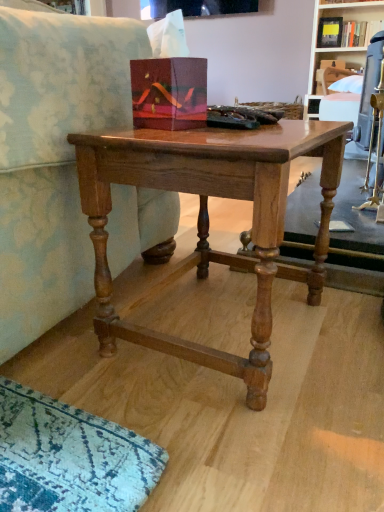
Question: From a real-world perspective, is wooden bookshelf at upper right, which is the first shelf from top to bottom, over shiny brown wood table at center?

Choices:
 (A) no
 (B) yes

Answer: (B)

Question: Is wooden bookshelf at upper right, which is the first shelf from top to bottom, turned away from shiny brown wood table at center?

Choices:
 (A) no
 (B) yes

Answer: (A)

Question: Considering the relative positions of wooden bookshelf at upper right, placed as the second shelf when sorted from bottom to top, and shiny brown wood table at center in the image provided, is wooden bookshelf at upper right, placed as the second shelf when sorted from bottom to top, to the right of shiny brown wood table at center from the viewer's perspective?

Choices:
 (A) yes
 (B) no

Answer: (A)

Question: Can you confirm if wooden bookshelf at upper right, which is the first shelf from top to bottom, is taller than shiny brown wood table at center?

Choices:
 (A) no
 (B) yes

Answer: (B)

Question: Considering the relative sizes of wooden bookshelf at upper right, placed as the second shelf when sorted from bottom to top, and shiny brown wood table at center in the image provided, is wooden bookshelf at upper right, placed as the second shelf when sorted from bottom to top, wider than shiny brown wood table at center?

Choices:
 (A) no
 (B) yes

Answer: (B)

Question: In the image, is shiny brown wood table at center on the left side or the right side of wooden bookshelf at upper right, which is the first shelf from top to bottom?

Choices:
 (A) left
 (B) right

Answer: (A)

Question: Considering the positions of shiny brown wood table at center and wooden bookshelf at upper right, placed as the second shelf when sorted from bottom to top, in the image, is shiny brown wood table at center taller or shorter than wooden bookshelf at upper right, placed as the second shelf when sorted from bottom to top,?

Choices:
 (A) short
 (B) tall

Answer: (A)

Question: Is point (342, 150) closer or farther from the camera than point (339, 48)?

Choices:
 (A) farther
 (B) closer

Answer: (B)

Question: Looking at the image, does shiny brown wood table at center seem bigger or smaller compared to wooden bookshelf at upper right, which is the first shelf from top to bottom?

Choices:
 (A) big
 (B) small

Answer: (B)

Question: Is shiny brown wood table at center inside the boundaries of wooden shelf at upper right, marked as the 1th shelf in a bottom-to-top arrangement, or outside?

Choices:
 (A) outside
 (B) inside

Answer: (A)

Question: From a real-world perspective, is shiny brown wood table at center above or below wooden shelf at upper right, positioned as the 2th shelf in top-to-bottom order?

Choices:
 (A) above
 (B) below

Answer: (B)

Question: Based on their positions, is shiny brown wood table at center located to the left or right of wooden shelf at upper right, marked as the 1th shelf in a bottom-to-top arrangement?

Choices:
 (A) right
 (B) left

Answer: (B)

Question: Relative to wooden shelf at upper right, positioned as the 2th shelf in top-to-bottom order, is shiny brown wood table at center in front or behind?

Choices:
 (A) front
 (B) behind

Answer: (A)

Question: Is wooden shelf at upper right, positioned as the 2th shelf in top-to-bottom order, to the left or to the right of shiny brown wood table at center in the image?

Choices:
 (A) right
 (B) left

Answer: (A)

Question: Is wooden shelf at upper right, positioned as the 2th shelf in top-to-bottom order, inside or outside of shiny brown wood table at center?

Choices:
 (A) inside
 (B) outside

Answer: (B)